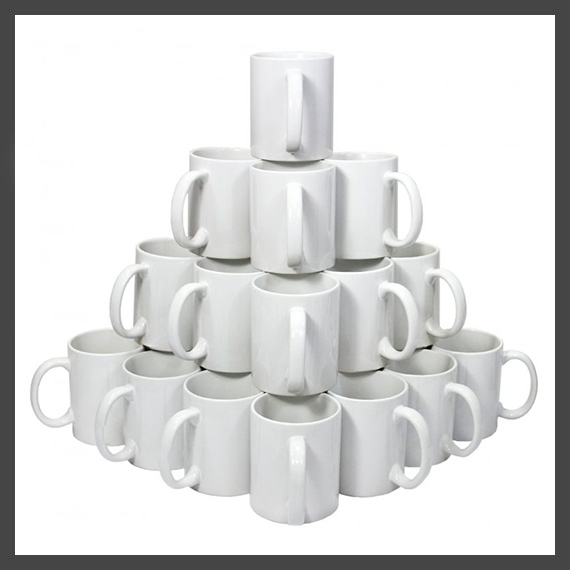
At what (x,y) coordinates should I click in order to perform the action: click on coffee mugs visible in row above bottom row. Please return your answer as a coordinate pair (x, y). Looking at the image, I should click on (156, 299), (225, 316), (268, 320), (369, 325), (420, 285).